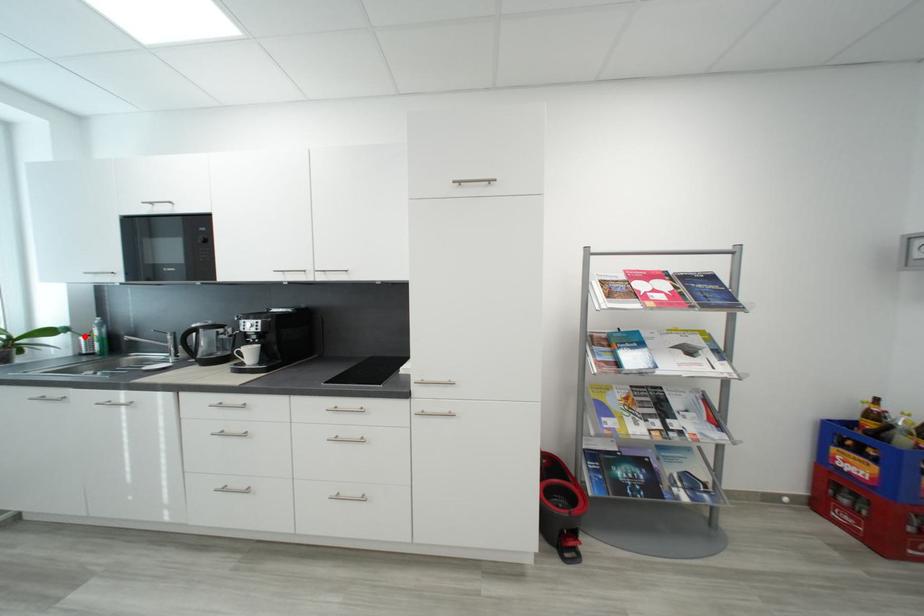
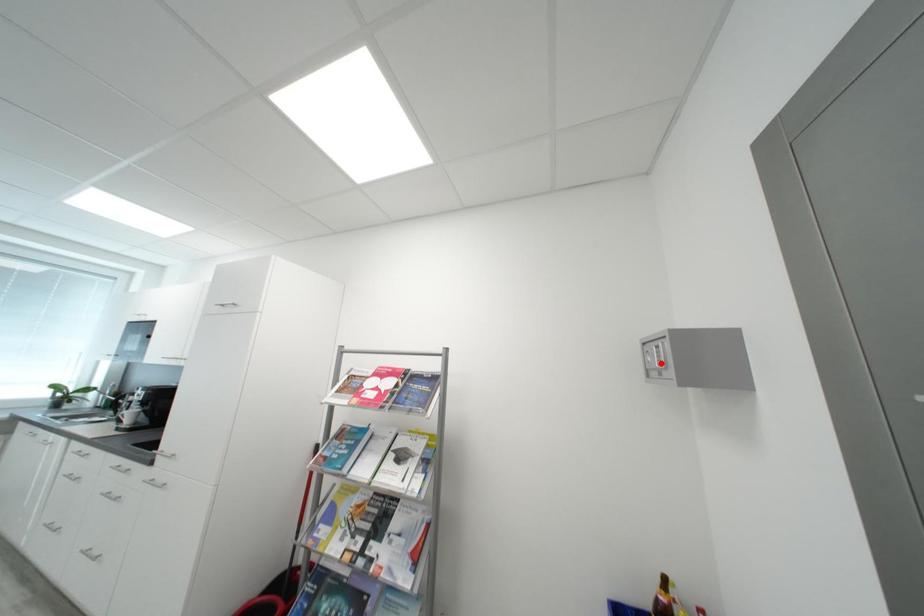
I am providing you with two images of the same scene from different viewpoints. A red point is marked on the first image and another point is marked on the second image. Is the marked point in image1 the same physical position as the marked point in image2?

No